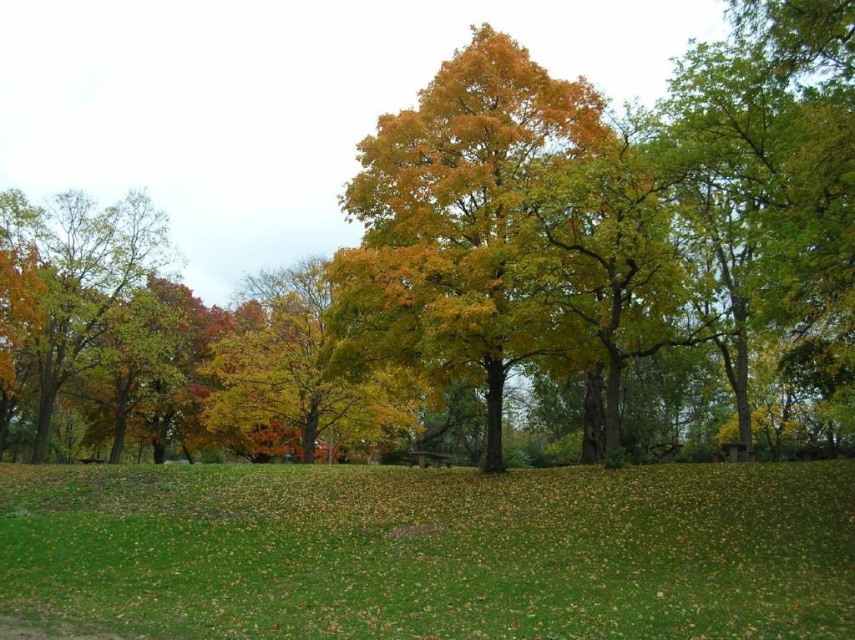
You are standing in the autumnal park scene and want to walk from the point closer to you to the farther point. Which path would you take between point (264, 538) and point (488, 460)?

You should walk from point (264, 538) to point (488, 460) because point (264, 538) is closer to the viewer and you need to move towards the farther point.